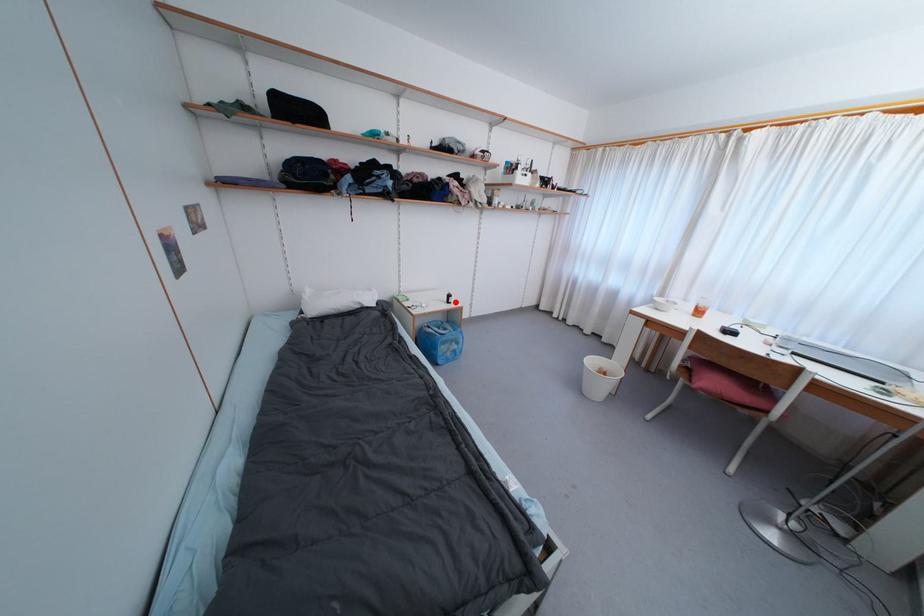
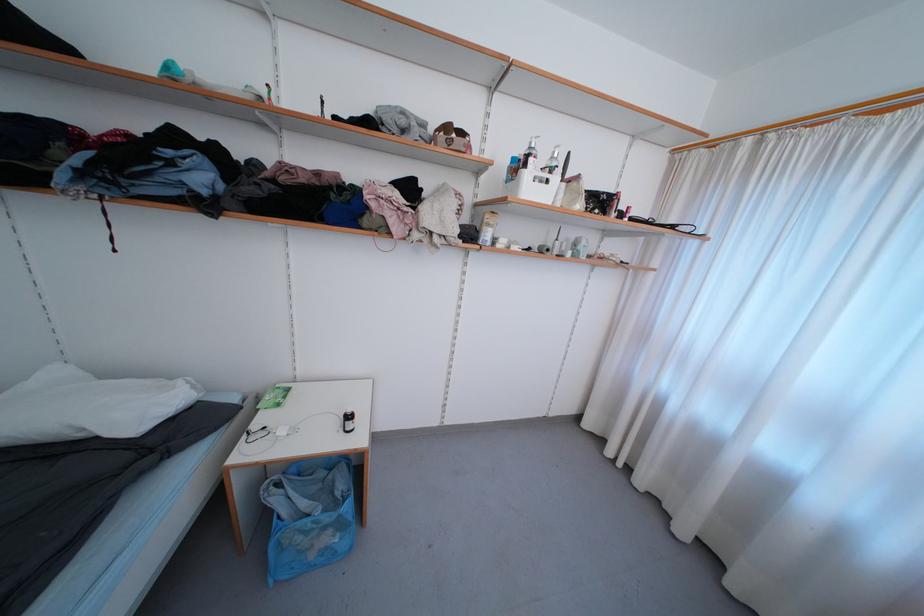
Question: I am providing you with two images of the same scene from different viewpoints. A red point is marked on the first image. Can you still see the location of the red point in image 2?

Choices:
 (A) Yes
 (B) No

Answer: (A)